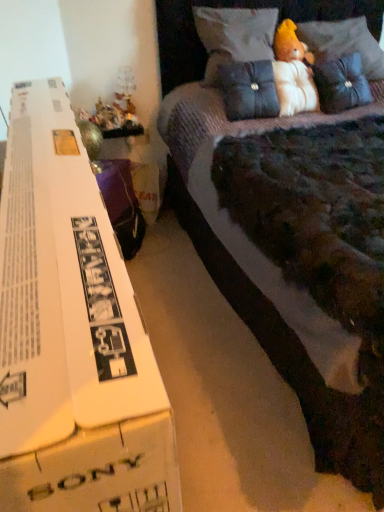
Question: Considering the positions of velvet purple bed at center and velvet blue pillow at upper center, the third pillow viewed from the right, in the image, is velvet purple bed at center wider or thinner than velvet blue pillow at upper center, the third pillow viewed from the right,?

Choices:
 (A) thin
 (B) wide

Answer: (B)

Question: Do you think velvet purple bed at center is within velvet blue pillow at upper center, the 1th pillow in the left-to-right sequence, or outside of it?

Choices:
 (A) inside
 (B) outside

Answer: (B)

Question: Based on their relative distances, which object is farther from the fluffy white teddy bear at upper right, the second toy viewed from the left?

Choices:
 (A) velvet dark blue pillow at upper right, the third pillow positioned from the left
 (B) white cardboard box at left
 (C) suede-like dark blue pillow at center, the 2th pillow from the right
 (D) metallic gold figurine at left, the second toy from the top
 (E) velvet blue pillow at upper center, the 1th pillow in the left-to-right sequence

Answer: (B)

Question: Considering the real-world distances, which object is closest to the fluffy white teddy bear at upper right, marked as the 2th toy in a bottom-to-top arrangement?

Choices:
 (A) velvet dark blue pillow at upper right, the third pillow positioned from the left
 (B) velvet purple bed at center
 (C) velvet blue pillow at upper center, the 1th pillow in the left-to-right sequence
 (D) metallic gold figurine at left, the 2th toy when ordered from right to left
 (E) suede-like dark blue pillow at center, the 2th pillow from the right

Answer: (A)